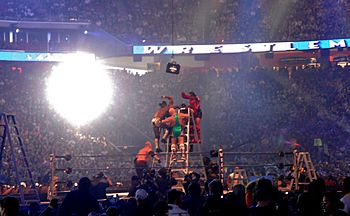
Identify the location of red wall. (272, 60), (223, 60), (341, 54).